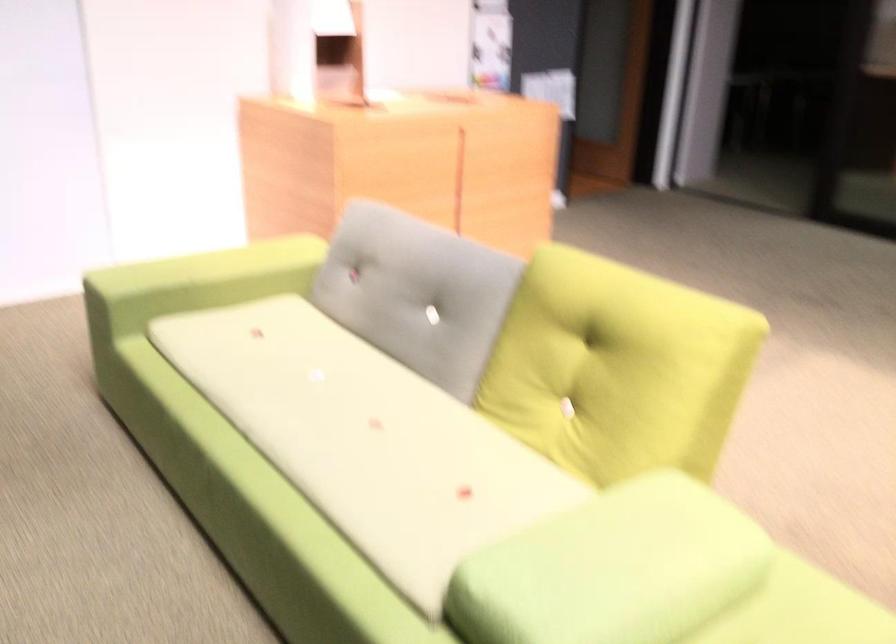
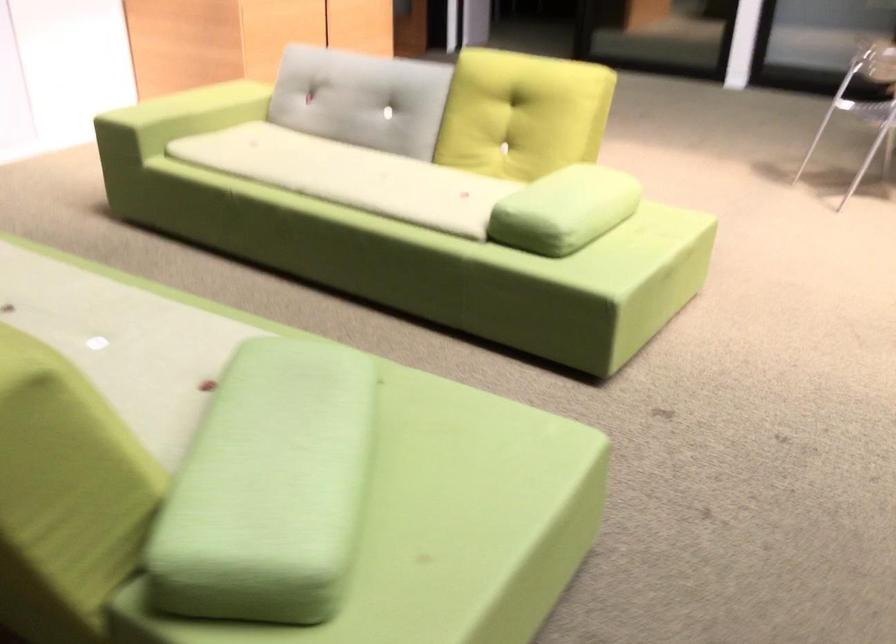
Find the pixel in the second image that matches [166,288] in the first image.

(178, 117)